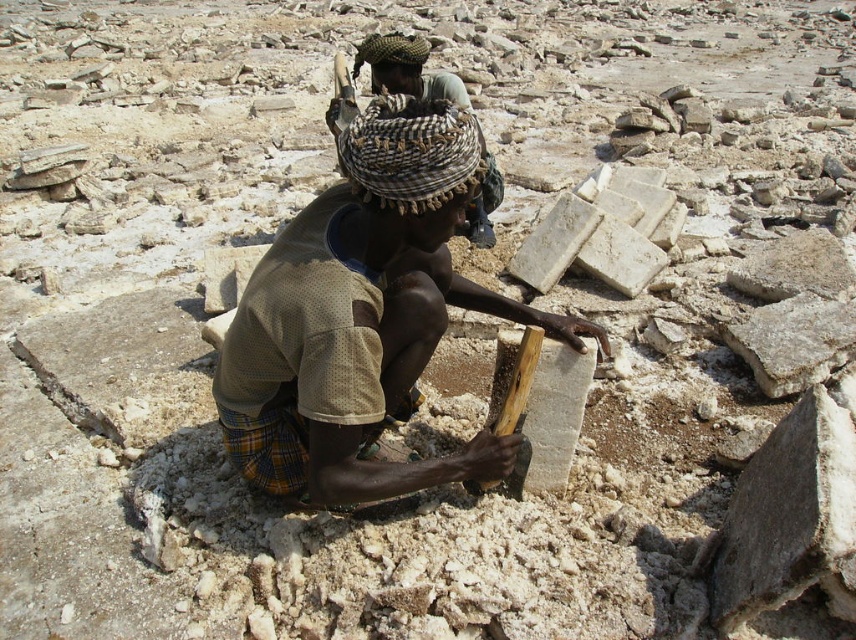
Question: Does brown wood at center have a greater width compared to brown woven scarf at center?

Choices:
 (A) yes
 (B) no

Answer: (A)

Question: Is brown wood at center smaller than brown woven scarf at center?

Choices:
 (A) yes
 (B) no

Answer: (B)

Question: Which of the following is the closest to the observer?

Choices:
 (A) (354, 401)
 (B) (426, 88)

Answer: (A)

Question: Can you confirm if brown wood at center is thinner than brown woven scarf at center?

Choices:
 (A) yes
 (B) no

Answer: (B)

Question: Which point appears farthest from the camera in this image?

Choices:
 (A) (502, 195)
 (B) (343, 467)

Answer: (A)